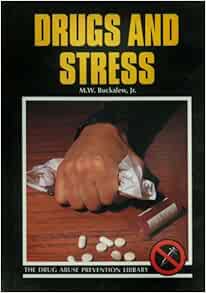
The image size is (206, 293). I want to click on table, so pyautogui.click(x=120, y=225).